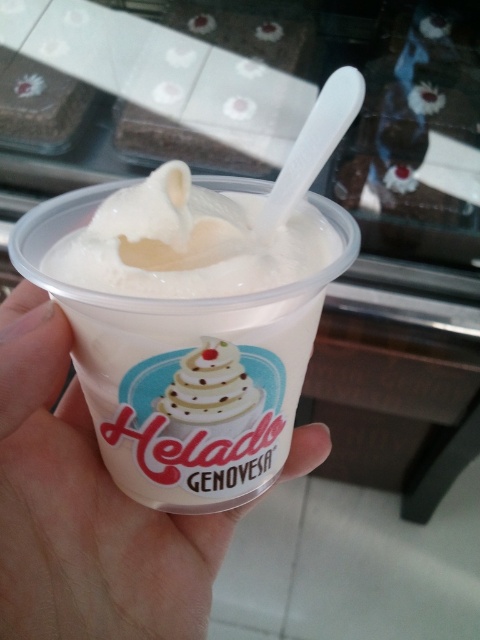
You are at a dessert shop and want to choose between the transparent plastic cup at center and the white matte plastic cup at center. Which cup is taller?

The transparent plastic cup at center is much taller than the white matte plastic cup at center.

You are a customer at a dessert shop and want to choose between the transparent plastic cup at center and the white matte plastic cup at center. Which cup is closer to you?

The transparent plastic cup at center is closer to you than the white matte plastic cup at center.